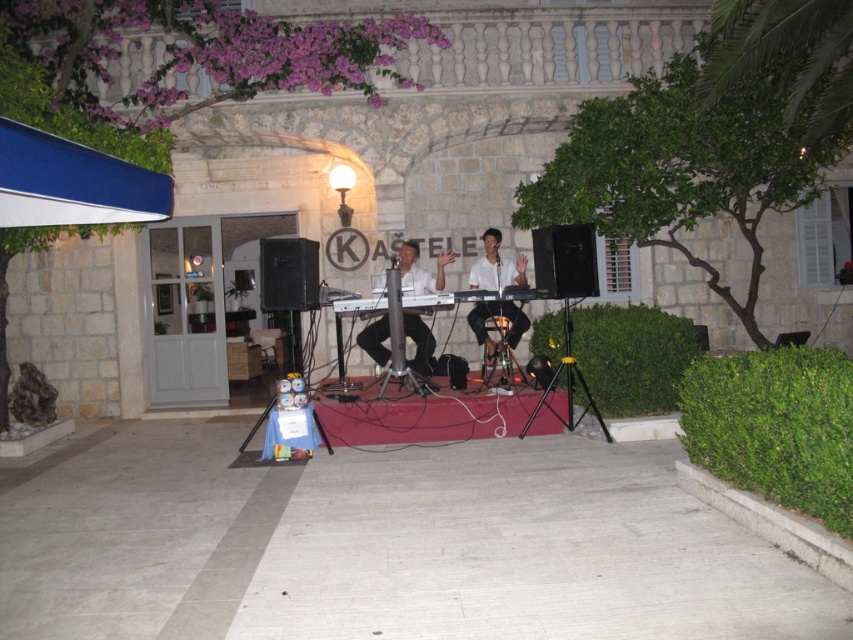
In the scene shown: Which is above, matte white keyboard at center or white matte keyboard at center?

matte white keyboard at center is higher up.

Is matte white keyboard at center wider than white matte keyboard at center?

Indeed, matte white keyboard at center has a greater width compared to white matte keyboard at center.

Measure the distance between matte white keyboard at center and camera.

The distance of matte white keyboard at center from camera is 9.02 meters.

Image resolution: width=853 pixels, height=640 pixels. Identify the location of matte white keyboard at center. (421, 269).